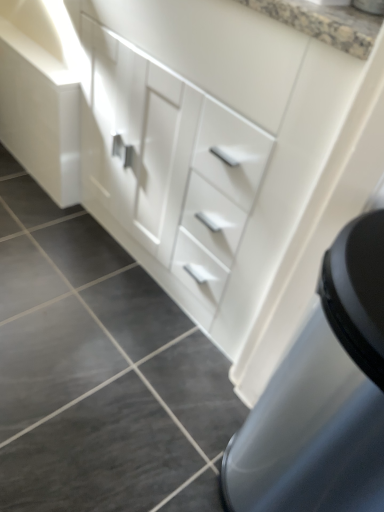
The image size is (384, 512). Describe the element at coordinates (168, 166) in the screenshot. I see `white glossy drawer at center` at that location.

The image size is (384, 512). I want to click on white glossy drawer at center, so click(168, 166).

Describe the element at coordinates (99, 455) in the screenshot. I see `dark gray tile at lower left` at that location.

The height and width of the screenshot is (512, 384). I want to click on dark gray tile at lower left, so click(99, 455).

What is the approximate width of dark gray tile at lower left?

dark gray tile at lower left is 13.19 inches in width.

In order to click on white glossy drawer at center in this screenshot , I will do `click(168, 166)`.

Which object is positioned more to the left, white glossy drawer at center or dark gray tile at lower left?

From the viewer's perspective, dark gray tile at lower left appears more on the left side.

Is the position of white glossy drawer at center less distant than that of dark gray tile at lower left?

That is True.

Which is in front, point (172, 75) or point (93, 432)?

Positioned in front is point (172, 75).

From the image's perspective, is white glossy drawer at center located above or below dark gray tile at lower left?

Based on their image positions, white glossy drawer at center is located above dark gray tile at lower left.

From a real-world perspective, is white glossy drawer at center located beneath dark gray tile at lower left?

Actually, white glossy drawer at center is physically above dark gray tile at lower left in the real world.

Consider the image. Is white glossy drawer at center wider or thinner than dark gray tile at lower left?

Considering their sizes, white glossy drawer at center looks broader than dark gray tile at lower left.

Who is taller, white glossy drawer at center or dark gray tile at lower left?

With more height is white glossy drawer at center.

Which of these two, white glossy drawer at center or dark gray tile at lower left, is bigger?

With larger size is white glossy drawer at center.

Is white glossy drawer at center inside or outside of dark gray tile at lower left?

The correct answer is: outside.

Would you say white glossy drawer at center is a long distance from dark gray tile at lower left?

No, white glossy drawer at center is not far away from dark gray tile at lower left.

Could you tell me if white glossy drawer at center is turned towards dark gray tile at lower left?

Yes, white glossy drawer at center is oriented towards dark gray tile at lower left.

How many degrees apart are the facing directions of white glossy drawer at center and dark gray tile at lower left?

white glossy drawer at center and dark gray tile at lower left are facing 92 degrees away from each other.

How distant is white glossy drawer at center from dark gray tile at lower left?

21.00 inches.

You are a GUI agent. You are given a task and a screenshot of the screen. Output one action in this format:
    pyautogui.click(x=<x>, y=<y>)
    Task: Click on the tile that appears below the white glossy drawer at center (from the image's perspective)
    This screenshot has width=384, height=512.
    Given the screenshot: What is the action you would take?
    pyautogui.click(x=99, y=455)

Which object is positioned more to the left, dark gray tile at lower left or white glossy drawer at center?

dark gray tile at lower left is more to the left.

Is dark gray tile at lower left closer to camera compared to white glossy drawer at center?

No, dark gray tile at lower left is further to the viewer.

Between point (129, 488) and point (176, 249), which one is positioned in front?

Point (129, 488)

From the image's perspective, is dark gray tile at lower left above white glossy drawer at center?

Actually, dark gray tile at lower left appears below white glossy drawer at center in the image.

From a real-world perspective, between dark gray tile at lower left and white glossy drawer at center, who is vertically lower?

From a 3D spatial view, dark gray tile at lower left is below.

Is dark gray tile at lower left wider than white glossy drawer at center?

No.

Considering the sizes of dark gray tile at lower left and white glossy drawer at center in the image, is dark gray tile at lower left taller or shorter than white glossy drawer at center?

Clearly, dark gray tile at lower left is shorter compared to white glossy drawer at center.

Considering the relative sizes of dark gray tile at lower left and white glossy drawer at center in the image provided, is dark gray tile at lower left smaller than white glossy drawer at center?

Correct, dark gray tile at lower left occupies less space than white glossy drawer at center.

Is dark gray tile at lower left spatially inside white glossy drawer at center, or outside of it?

The correct answer is: outside.

Is there a large distance between dark gray tile at lower left and white glossy drawer at center?

No, there isn't a large distance between dark gray tile at lower left and white glossy drawer at center.

Does dark gray tile at lower left turn towards white glossy drawer at center?

Answer: No, dark gray tile at lower left is not aimed at white glossy drawer at center.

What's the angular difference between dark gray tile at lower left and white glossy drawer at center's facing directions?

dark gray tile at lower left and white glossy drawer at center are facing 92 degrees away from each other.

Where is `drawer that appears on the right of dark gray tile at lower left`? This screenshot has width=384, height=512. drawer that appears on the right of dark gray tile at lower left is located at coordinates (168, 166).

Image resolution: width=384 pixels, height=512 pixels. In the image, there is a white glossy drawer at center. In order to click on tile below it (from the image's perspective) in this screenshot , I will do `click(99, 455)`.

Identify the location of drawer above the dark gray tile at lower left (from a real-world perspective). This screenshot has width=384, height=512. (168, 166).